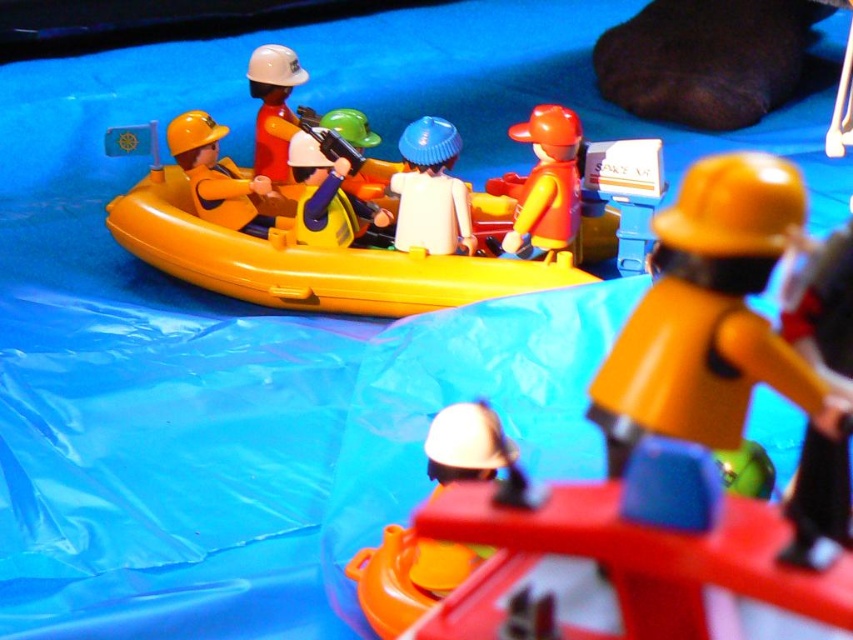
You are a parent setting up a playset for your child. You have a yellow rubber boat at center and a matte yellow helmet at center. According to the scene, which object is positioned to the left?

The yellow rubber boat at center is to the left of the matte yellow helmet at center, so the yellow rubber boat at center is positioned to the left.

You are setting up a playset and need to place the yellow rubber boat at center and the matte yellow helmet at center. Which object should be positioned higher to match the scene?

The yellow rubber boat at center should be positioned higher than the matte yellow helmet at center because the yellow rubber boat at center is taller than the matte yellow helmet at center.